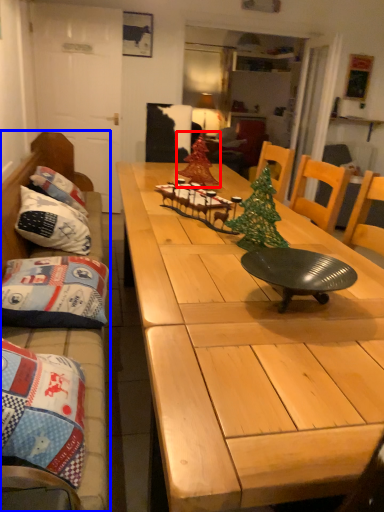
Question: Among these objects, which one is nearest to the camera, christmas tree (highlighted by a red box) or studio couch (highlighted by a blue box)?

Choices:
 (A) christmas tree
 (B) studio couch

Answer: (B)